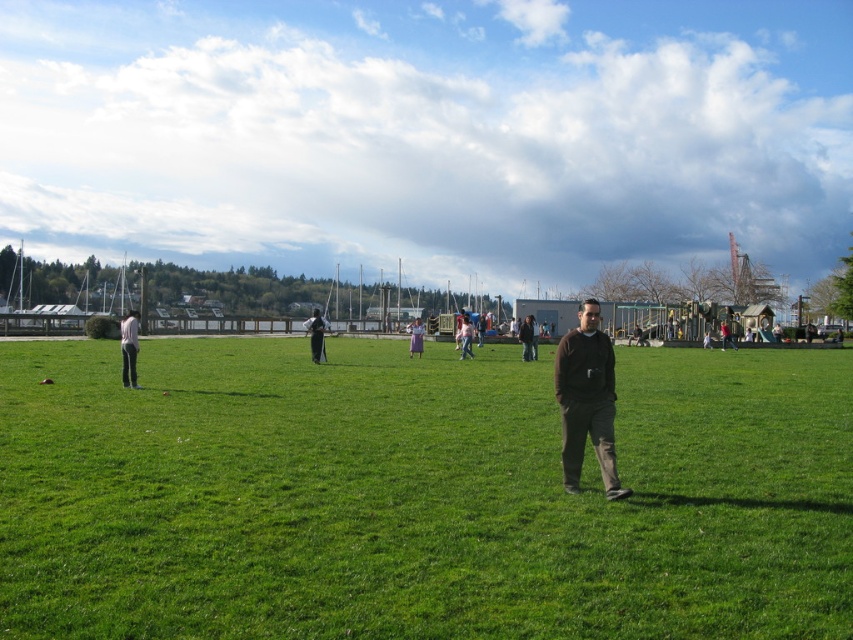
Question: Which point is farther from the camera taking this photo?

Choices:
 (A) (724, 339)
 (B) (312, 346)
 (C) (468, 342)
 (D) (596, 458)

Answer: (A)

Question: Among these objects, which one is farthest from the camera?

Choices:
 (A) light pink fabric pants at left
 (B) pink fabric dress at center

Answer: (B)

Question: Is green grass at center positioned at the back of light pink fabric pants at left?

Choices:
 (A) no
 (B) yes

Answer: (A)

Question: Which of the following is the closest to the observer?

Choices:
 (A) cloudy sky at upper center
 (B) green grass at center

Answer: (B)

Question: Can you confirm if green grass at center is positioned to the left of light pink fabric pants at left?

Choices:
 (A) no
 (B) yes

Answer: (A)

Question: Can you confirm if dark brown sweater at center is thinner than brown leather jacket at center?

Choices:
 (A) no
 (B) yes

Answer: (A)